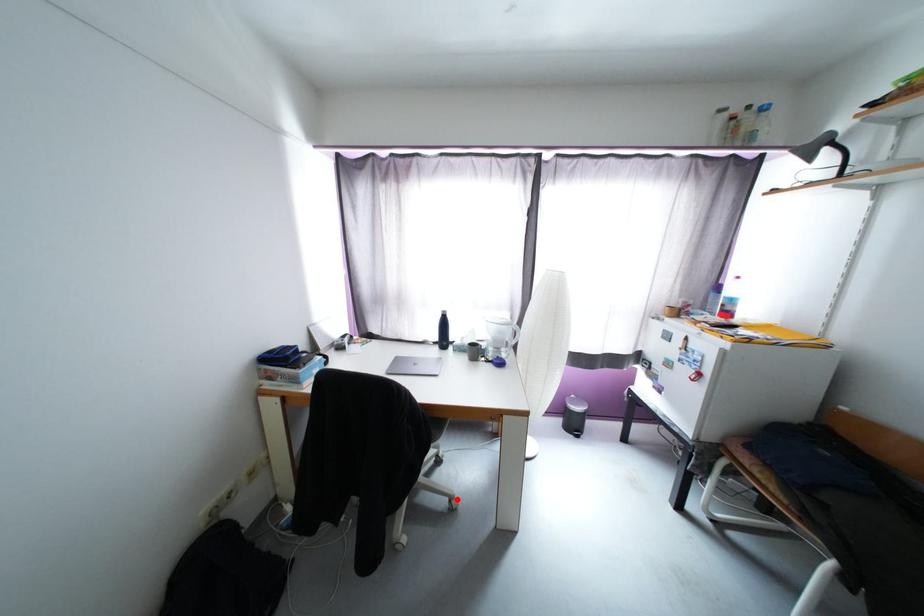
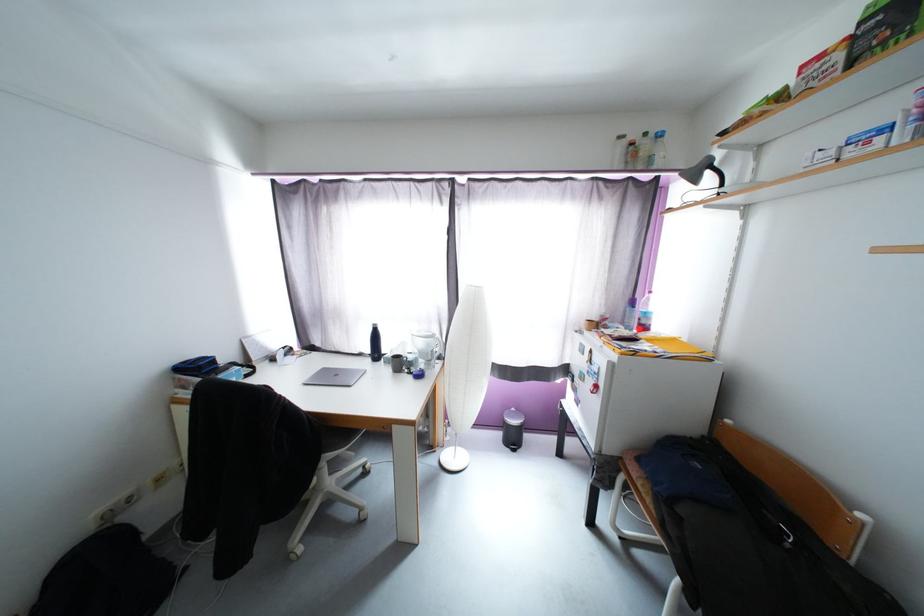
In the second image, find the point that corresponds to the highlighted location in the first image.

(367, 511)